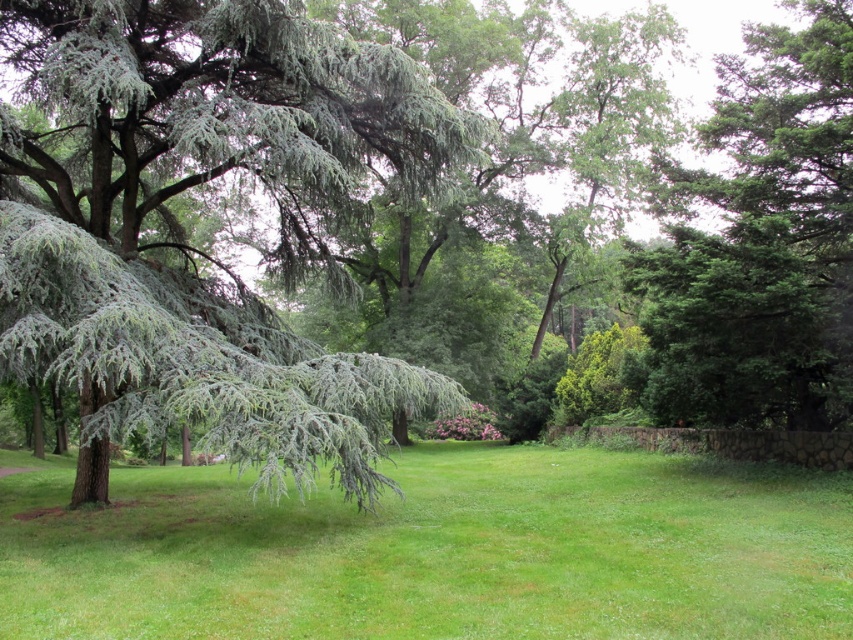
You are standing in the park and want to walk from point A to point B. Point A is located at coordinates point [125,422] and point B is at point [555,620]. Which point is closer to you when you are facing the direction of the evergreen tree on the left side of the image?

Point [555,620] is closer to you because it is in front of point [125,422] when facing the evergreen tree on the left side.

You are standing in the park and see a point marked at coordinates (190, 244). What type of vegetation is located at this point?

The point at (190, 244) corresponds to green needle like vegetation at left.